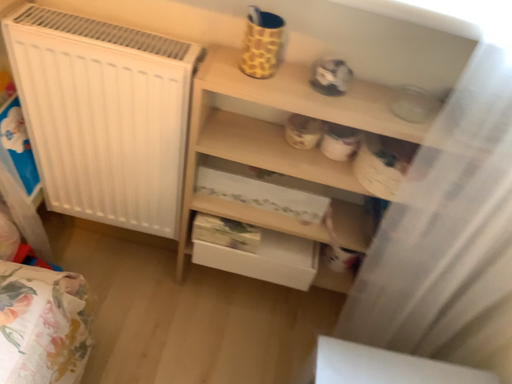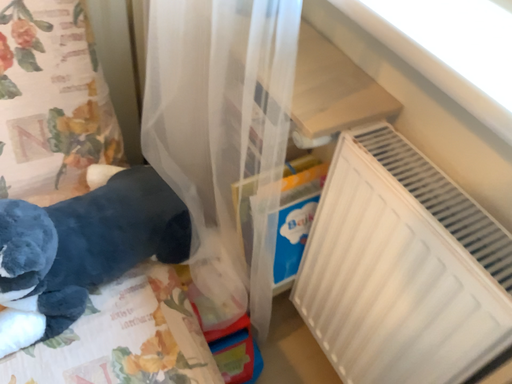
Question: Which way did the camera rotate in the video?

Choices:
 (A) rotated right
 (B) rotated left

Answer: (B)